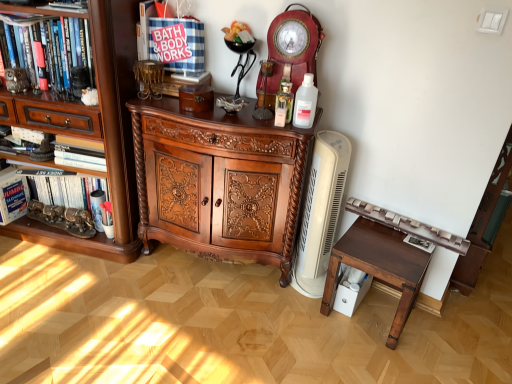
Where is `free location in front of dark brown wooden table at right`? free location in front of dark brown wooden table at right is located at coordinates (378, 359).